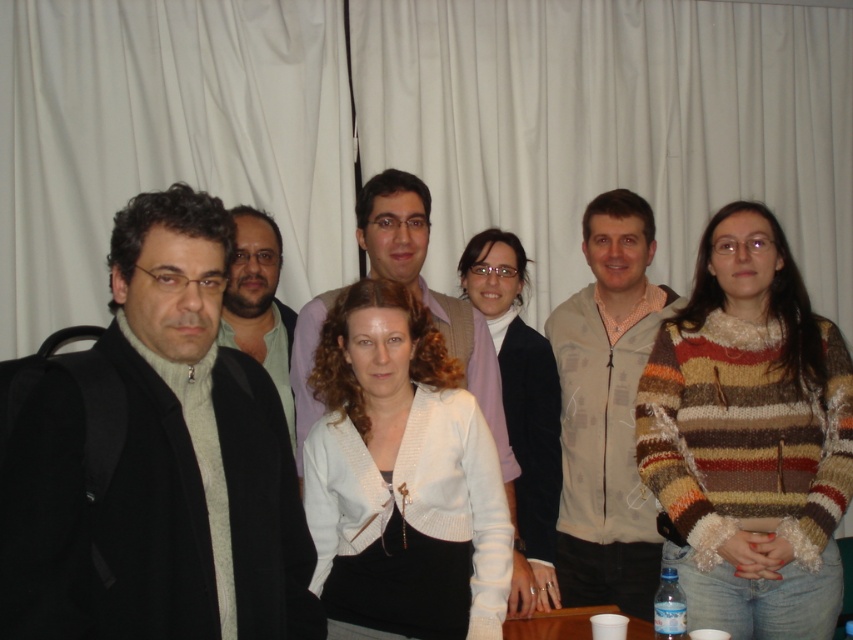
Question: Which object is farther from the camera taking this photo?

Choices:
 (A) matte green shirt at center
 (B) white knitted cardigan at center
 (C) knitted striped sweater at center
 (D) white knitted sweater at center

Answer: (A)

Question: Does white knitted cardigan at center lie in front of white knitted sweater at center?

Choices:
 (A) yes
 (B) no

Answer: (A)

Question: Is white knitted sweater at center wider than matte green shirt at center?

Choices:
 (A) no
 (B) yes

Answer: (B)

Question: Which point is closer to the camera?

Choices:
 (A) beige zip-up vest at center
 (B) black matte coat at left
 (C) white knitted sweater at center

Answer: (B)

Question: Is white knitted sweater at center above matte green shirt at center?

Choices:
 (A) yes
 (B) no

Answer: (B)

Question: Which point is closer to the camera?

Choices:
 (A) beige zip-up vest at center
 (B) white knitted cardigan at center
 (C) matte green shirt at center

Answer: (B)